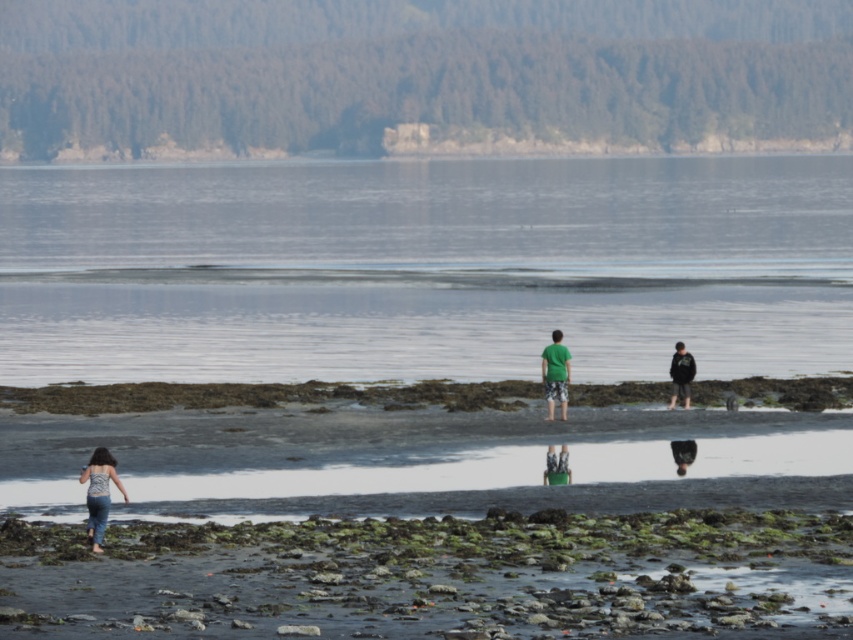
Question: Which is farther from the dark gray fabric pants at center?

Choices:
 (A) black cotton shirt at right
 (B) clear water at center
 (C) green cotton shirt at center
 (D) green fabric shirt at center

Answer: (B)

Question: Which point is farther from the camera taking this photo?

Choices:
 (A) (728, 336)
 (B) (567, 472)
 (C) (558, 388)
 (D) (693, 444)

Answer: (A)

Question: Can you confirm if clear water at center is thinner than black cotton shirt at right?

Choices:
 (A) no
 (B) yes

Answer: (A)

Question: Does black cotton shirt at right have a greater width compared to dark gray fabric pants at center?

Choices:
 (A) no
 (B) yes

Answer: (B)

Question: Considering the real-world distances, which object is farthest from the clear water at center?

Choices:
 (A) green fabric shirt at center
 (B) green mossy rocks at lower center
 (C) green cotton shirt at center

Answer: (A)

Question: Does green mossy rocks at lower center have a larger size compared to black cotton shirt at right?

Choices:
 (A) no
 (B) yes

Answer: (B)